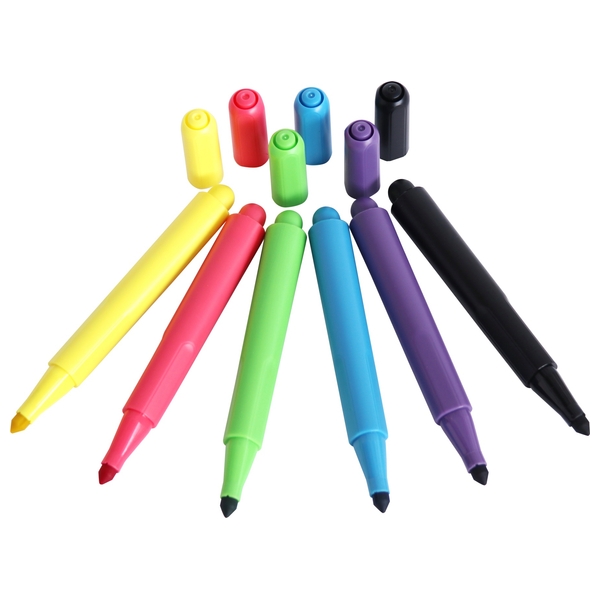
I want to click on markers, so click(x=90, y=328), click(x=184, y=365), click(x=271, y=379), click(x=373, y=385), click(x=432, y=369), click(x=526, y=326).